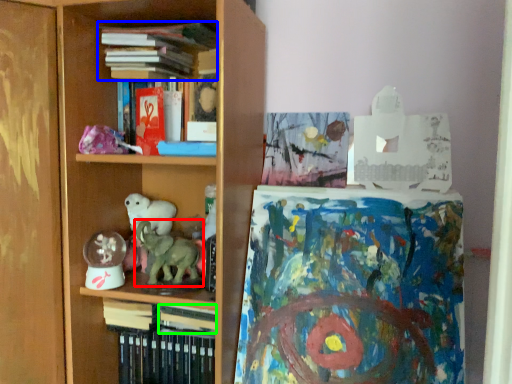
Question: Which object is the closest to the animal (highlighted by a red box)? Choose among these: book (highlighted by a blue box) or book (highlighted by a green box).

Choices:
 (A) book
 (B) book

Answer: (B)